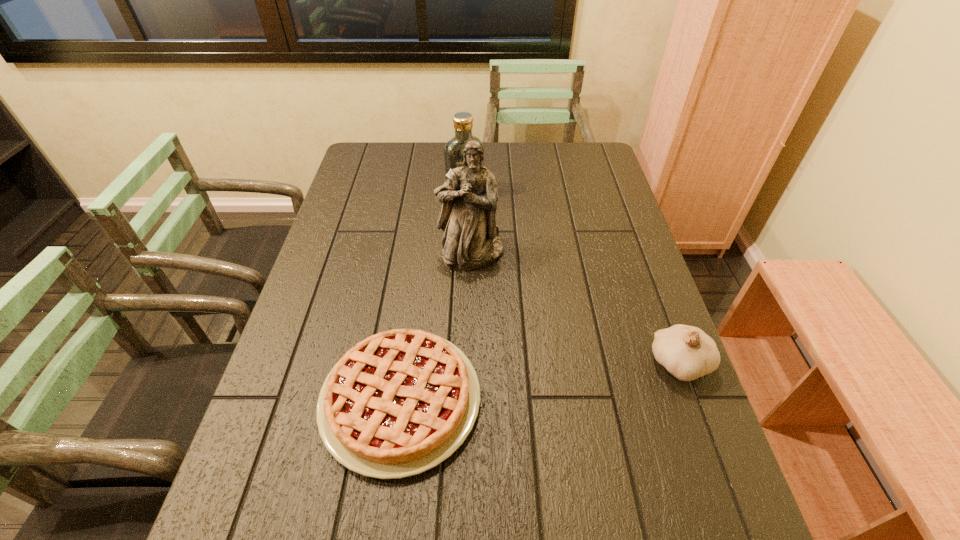
The width and height of the screenshot is (960, 540). I want to click on free spot on the desktop that is between the shortest object and the garlic and is positioned on the front-facing side of the farthest object, so click(x=582, y=377).

Find the location of a particular element. Image resolution: width=960 pixels, height=540 pixels. vacant space on the desktop that is between the pie and the rightmost object and is positioned on the front-facing side of the figurine is located at coordinates (528, 383).